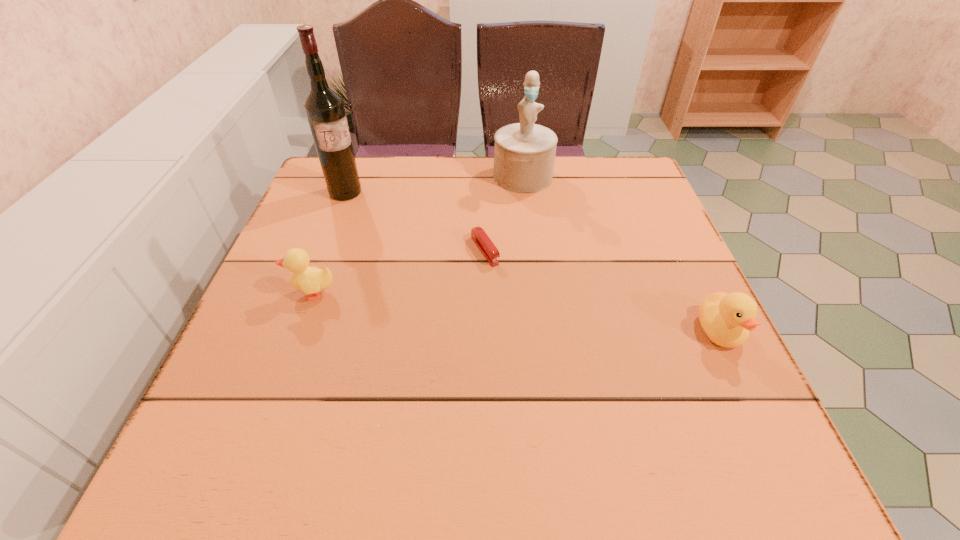
Where is `free point between the right duckling and the shortest object`? free point between the right duckling and the shortest object is located at coordinates (602, 291).

Where is `free space between the left duckling and the wine bottle`? The width and height of the screenshot is (960, 540). free space between the left duckling and the wine bottle is located at coordinates (329, 242).

Find the location of a particular element. vacant area between the left duckling and the second tallest object is located at coordinates (418, 234).

Where is `vacant area that lies between the tallest object and the right duckling`? vacant area that lies between the tallest object and the right duckling is located at coordinates (533, 262).

At what (x,y) coordinates should I click in order to perform the action: click on free spot between the wine bottle and the third nearest object. Please return your answer as a coordinate pair (x, y). Looking at the image, I should click on (415, 221).

Where is `vacant point located between the fourth shortest object and the third farthest object`? This screenshot has height=540, width=960. vacant point located between the fourth shortest object and the third farthest object is located at coordinates (504, 213).

Find the location of a particular element. The width and height of the screenshot is (960, 540). free spot between the second tallest object and the farther duckling is located at coordinates (418, 234).

Where is `blank region between the right duckling and the shortest object`? The height and width of the screenshot is (540, 960). blank region between the right duckling and the shortest object is located at coordinates (602, 291).

You are a GUI agent. You are given a task and a screenshot of the screen. Output one action in this format:
    pyautogui.click(x=<x>, y=<y>)
    Task: Click on the free point between the tallest object and the figurine
    
    Given the screenshot: What is the action you would take?
    pyautogui.click(x=434, y=184)

At what (x,y) coordinates should I click in order to perform the action: click on empty location between the figurine and the third nearest object. Please return your answer as a coordinate pair (x, y). The width and height of the screenshot is (960, 540). Looking at the image, I should click on coord(504,213).